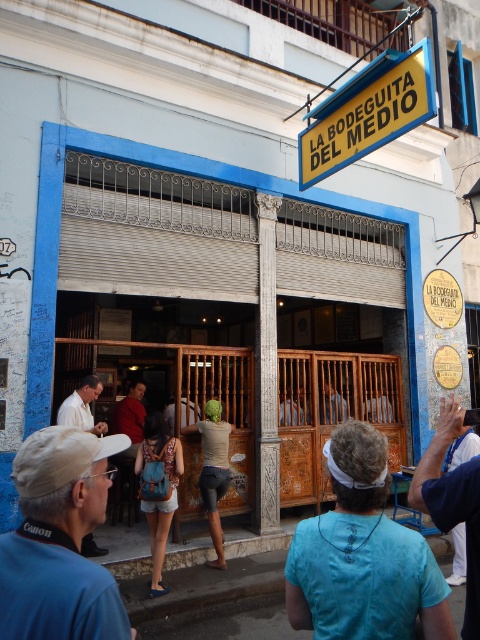
Does yellowsignboardla bodeguita del medio at upper center have a lesser width compared to blue fabric shirt at center?

No, yellowsignboardla bodeguita del medio at upper center is not thinner than blue fabric shirt at center.

Looking at this image, which is more to the left, yellowsignboardla bodeguita del medio at upper center or blue fabric shirt at center?

From the viewer's perspective, blue fabric shirt at center appears more on the left side.

Locate an element on the screen. Image resolution: width=480 pixels, height=640 pixels. yellowsignboardla bodeguita del medio at upper center is located at coordinates (368, 112).

Between point (365, 148) and point (219, 444), which one is positioned behind?

Positioned behind is point (219, 444).

Does yellowsignboardla bodeguita del medio at upper center have a smaller size compared to light brown textured shirt at center?

Actually, yellowsignboardla bodeguita del medio at upper center might be larger than light brown textured shirt at center.

Between point (314, 177) and point (203, 468), which one is positioned in front?

Point (203, 468) is in front.

The width and height of the screenshot is (480, 640). I want to click on yellowsignboardla bodeguita del medio at upper center, so click(368, 112).

Between blue fabric cap at lower left and white shirt at left, which one has less height?

With less height is blue fabric cap at lower left.

Does point (84, 452) come behind point (96, 380)?

That is False.

The image size is (480, 640). What do you see at coordinates (59, 541) in the screenshot?
I see `blue fabric cap at lower left` at bounding box center [59, 541].

You are a GUI agent. You are given a task and a screenshot of the screen. Output one action in this format:
    pyautogui.click(x=<x>, y=<y>)
    Task: Click on the blue fabric cap at lower left
    This screenshot has height=640, width=480.
    Given the screenshot: What is the action you would take?
    pyautogui.click(x=59, y=541)